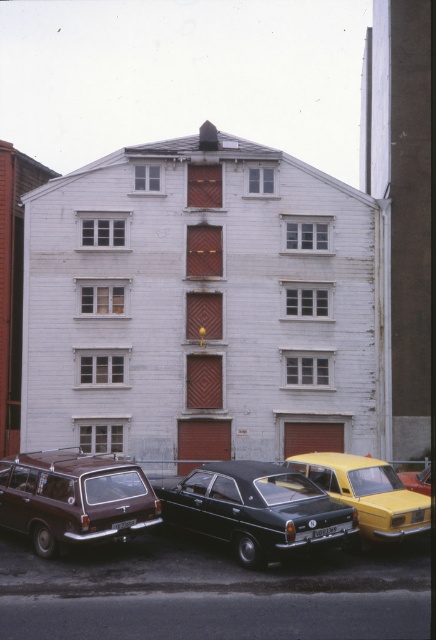
Question: Which point appears farthest from the camera in this image?

Choices:
 (A) (320, 502)
 (B) (426, 467)
 (C) (320, 464)
 (D) (81, 531)

Answer: (B)

Question: Does shiny black sedan at center have a lesser width compared to brown matte station wagon at lower left?

Choices:
 (A) no
 (B) yes

Answer: (B)

Question: Is shiny black sedan at center bigger than yellow matte car at lower right?

Choices:
 (A) yes
 (B) no

Answer: (B)

Question: Which of the following is the farthest from the observer?

Choices:
 (A) shiny black sedan at center
 (B) brown matte station wagon at lower left
 (C) yellow matte car at center
 (D) yellow matte car at lower right

Answer: (D)

Question: Does shiny black sedan at center have a greater width compared to yellow matte car at center?

Choices:
 (A) yes
 (B) no

Answer: (A)

Question: Which is nearer to the shiny black sedan at center?

Choices:
 (A) brown matte station wagon at lower left
 (B) yellow matte car at lower right
 (C) yellow matte car at center

Answer: (C)